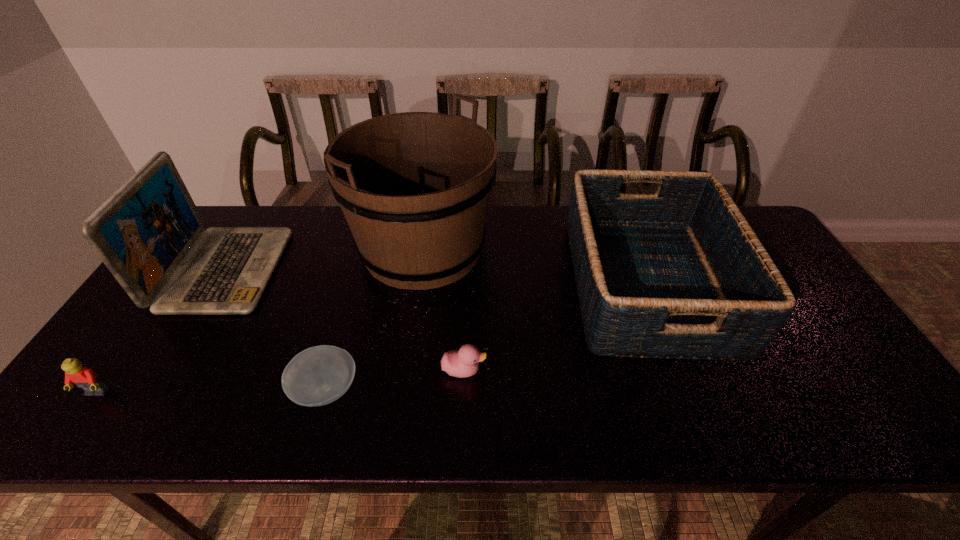
I want to click on free space between the third tallest object and the duckling, so click(x=556, y=327).

Locate an element on the screen. This screenshot has width=960, height=540. unoccupied area between the tallest object and the Lego is located at coordinates point(259,321).

Locate an element on the screen. object that is the fourth closest to the fifth shortest object is located at coordinates (461, 363).

This screenshot has width=960, height=540. Find the location of `the fifth closest object to the fourth tallest object`. the fifth closest object to the fourth tallest object is located at coordinates (680, 274).

At what (x,y) coordinates should I click in order to perform the action: click on vacant space that satisfies the following two spatial constraints: 1. on the screen of the fifth shortest object; 2. on the face of the Lego. Please return your answer as a coordinate pair (x, y). The image size is (960, 540). Looking at the image, I should click on (152, 393).

The height and width of the screenshot is (540, 960). What are the coordinates of `vacant space that satisfies the following two spatial constraints: 1. on the screen of the fifth shortest object; 2. on the face of the fourth tallest object` in the screenshot? It's located at (152, 393).

I want to click on vacant space that satisfies the following two spatial constraints: 1. on the front side of the basket; 2. on the front-facing side of the duckling, so click(x=681, y=370).

Where is `free region that satisfies the following two spatial constraints: 1. on the screen of the bowl; 2. on the right side of the laptop computer`? The width and height of the screenshot is (960, 540). free region that satisfies the following two spatial constraints: 1. on the screen of the bowl; 2. on the right side of the laptop computer is located at coordinates (154, 390).

Locate an element on the screen. Image resolution: width=960 pixels, height=540 pixels. free space that satisfies the following two spatial constraints: 1. on the front-facing side of the fifth tallest object; 2. on the face of the third shortest object is located at coordinates (463, 393).

Identify the location of free space that satisfies the following two spatial constraints: 1. on the front side of the rightmost object; 2. on the front-facing side of the fifth tallest object. (681, 370).